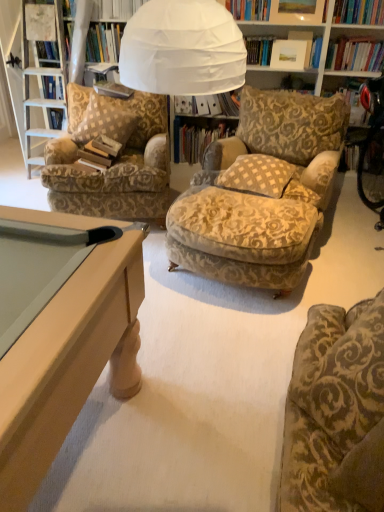
Question: From a real-world perspective, is velvet gold-patterned chair at lower right, which is the 2th chair from left to right, under patterned fabric armchair at left, the first chair when ordered from back to front?

Choices:
 (A) no
 (B) yes

Answer: (A)

Question: Is velvet gold-patterned chair at lower right, the 2th chair when ordered from top to bottom, located outside patterned fabric armchair at left, placed as the second chair when sorted from bottom to top?

Choices:
 (A) yes
 (B) no

Answer: (A)

Question: Considering the relative positions of velvet gold-patterned chair at lower right, the 2th chair when ordered from top to bottom, and patterned fabric armchair at left, placed as the second chair when sorted from bottom to top, in the image provided, is velvet gold-patterned chair at lower right, the 2th chair when ordered from top to bottom, behind patterned fabric armchair at left, placed as the second chair when sorted from bottom to top,?

Choices:
 (A) no
 (B) yes

Answer: (A)

Question: Is velvet gold-patterned chair at lower right, which appears as the first chair when viewed from the front, shorter than patterned fabric armchair at left, placed as the first chair when sorted from top to bottom?

Choices:
 (A) yes
 (B) no

Answer: (A)

Question: From a real-world perspective, is velvet gold-patterned chair at lower right, which appears as the first chair when viewed from the front, over patterned fabric armchair at left, the 2th chair from the right?

Choices:
 (A) yes
 (B) no

Answer: (A)

Question: Is white paper book at center, the third book viewed from the front, in front of or behind patterned fabric armchair at left, the first chair when ordered from back to front, in the image?

Choices:
 (A) front
 (B) behind

Answer: (B)

Question: Is white paper book at center, placed as the second book when sorted from back to front, inside the boundaries of patterned fabric armchair at left, the first chair viewed from the left, or outside?

Choices:
 (A) outside
 (B) inside

Answer: (A)

Question: From a real-world perspective, is white paper book at center, the third book viewed from the front, positioned above or below patterned fabric armchair at left, the 2th chair from the right?

Choices:
 (A) above
 (B) below

Answer: (A)

Question: In terms of height, does white paper book at center, placed as the second book when sorted from back to front, look taller or shorter compared to patterned fabric armchair at left, the first chair when ordered from back to front?

Choices:
 (A) short
 (B) tall

Answer: (A)

Question: From the image's perspective, is brown paper book at center, marked as the first book in a front-to-back arrangement, located above or below velvet gold-patterned chair at lower right, which appears as the first chair when viewed from the front?

Choices:
 (A) below
 (B) above

Answer: (B)

Question: In the image, is brown paper book at center, marked as the first book in a front-to-back arrangement, on the left side or the right side of velvet gold-patterned chair at lower right, which appears as the first chair when viewed from the front?

Choices:
 (A) right
 (B) left

Answer: (B)

Question: Based on their sizes in the image, would you say brown paper book at center, arranged as the 4th book when viewed from the back, is bigger or smaller than velvet gold-patterned chair at lower right, the 2th chair when ordered from top to bottom?

Choices:
 (A) big
 (B) small

Answer: (B)

Question: Is brown paper book at center, marked as the first book in a front-to-back arrangement, situated inside velvet gold-patterned chair at lower right, arranged as the first chair when ordered from the bottom, or outside?

Choices:
 (A) outside
 (B) inside

Answer: (A)

Question: Looking at their shapes, would you say white paper book at center, the third book viewed from the front, is wider or thinner than hardcover book at center, which is counted as the 3th book, starting from the back?

Choices:
 (A) thin
 (B) wide

Answer: (B)

Question: Do you think white paper book at center, placed as the second book when sorted from back to front, is within hardcover book at center, which is counted as the 3th book, starting from the back, or outside of it?

Choices:
 (A) inside
 (B) outside

Answer: (B)